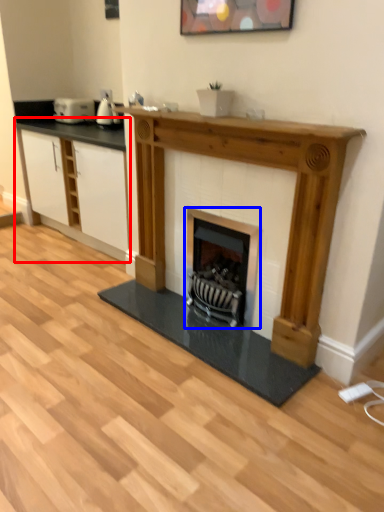
Question: Which point is further to the camera, cabinetry (highlighted by a red box) or wood burning stove (highlighted by a blue box)?

Choices:
 (A) cabinetry
 (B) wood burning stove

Answer: (A)